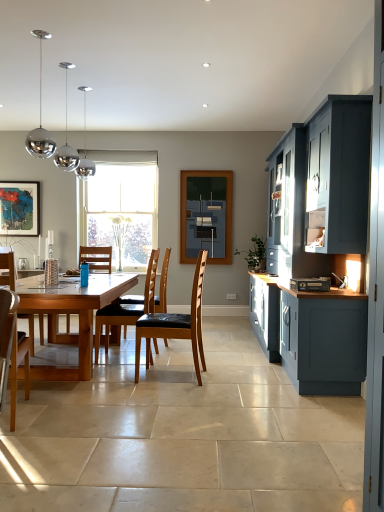
Question: From the image's perspective, is brown leather chair at center positioned above or below black plastic dvd player at right?

Choices:
 (A) above
 (B) below

Answer: (B)

Question: From a real-world perspective, is brown leather chair at center physically located above or below black plastic dvd player at right?

Choices:
 (A) above
 (B) below

Answer: (B)

Question: Which object is positioned farthest from the brown leather chair at center, the second chair from the right?

Choices:
 (A) matte blue cabinet at right
 (B) matte black picture frame at upper left
 (C) wooden chair at left, which ranks as the 1th chair in left-to-right order
 (D) brown leather chair at center, placed as the second chair when sorted from back to front
 (E) matte black painting at center

Answer: (B)

Question: Which is nearer to the brown leather chair at center?

Choices:
 (A) matte blue cabinet at right
 (B) matte black picture frame at upper left
 (C) wooden chair at left, which appears as the 3th chair when viewed from the right
 (D) matte black painting at center
 (E) brown leather chair at center, marked as the 2th chair in a front-to-back arrangement

Answer: (E)